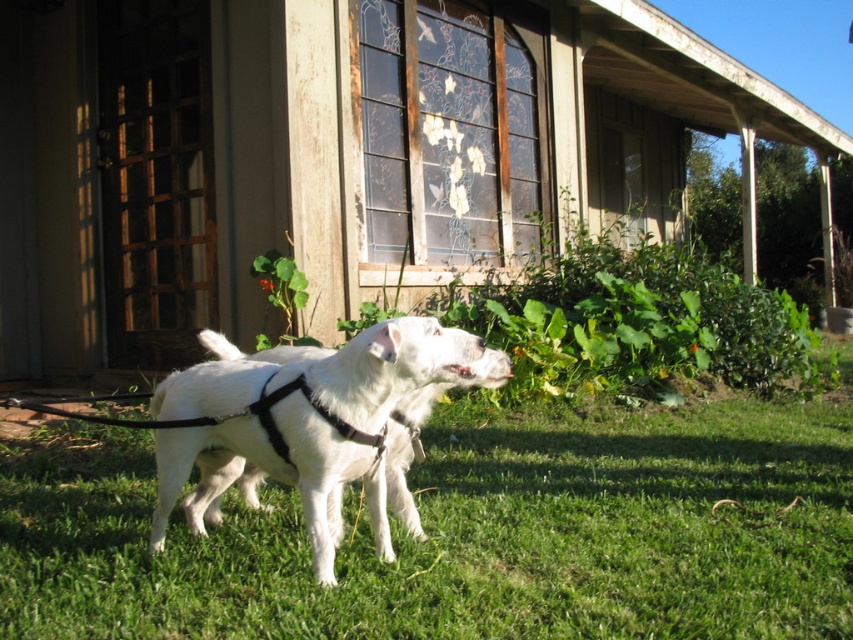
You are a dog owner trying to decide where to place your dog for a photo. You have two options on the wooden porch at center and the green grass at lower center. Which location is wider?

The wooden porch at center might be wider than green grass at lower center, so the wooden porch at center is the wider option.

You are a dog owner who wants to ensure your dog stays within the visible area of the image. Given the green grass at lower center and the white matte harness at center, which object is closer to the edge of the visible area?

The green grass at lower center is positioned on the right side of the white matte harness at center, so the green grass at lower center is closer to the edge of the visible area.

You are a dog owner who wants to ensure your dog has enough space to move around. Given the wooden porch at center and the green grass at lower center, which area provides more space for the dog to roam freely?

The wooden porch at center is bigger than the green grass at lower center, so it provides more space for the dog to roam freely.